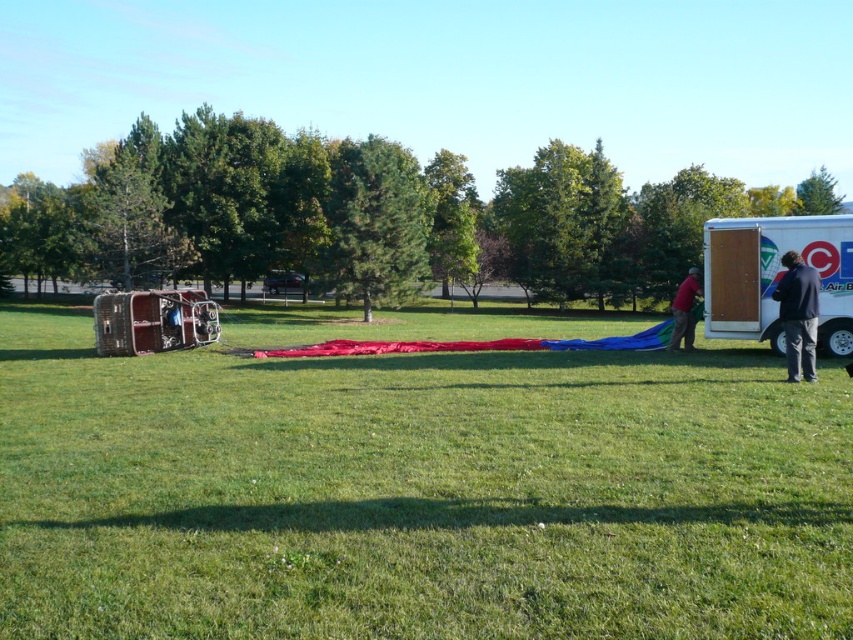
Question: Which of the following is the farthest from the observer?

Choices:
 (A) red fabric balloon at right
 (B) dark blue jacket at right

Answer: (A)

Question: Considering the real-world distances, which object is farthest from the dark blue jacket at right?

Choices:
 (A) white cardboard trailer at right
 (B) green grassy field at center

Answer: (B)

Question: Which point is closer to the camera?

Choices:
 (A) red fabric balloon at right
 (B) dark blue jacket at right

Answer: (B)

Question: Where is green grassy field at center located in relation to white cardboard trailer at right in the image?

Choices:
 (A) right
 (B) left

Answer: (B)

Question: Is white cardboard trailer at right to the right of red fabric balloon at right from the viewer's perspective?

Choices:
 (A) yes
 (B) no

Answer: (B)

Question: Where is green grassy field at center located in relation to red fabric balloon at right in the image?

Choices:
 (A) right
 (B) left

Answer: (B)